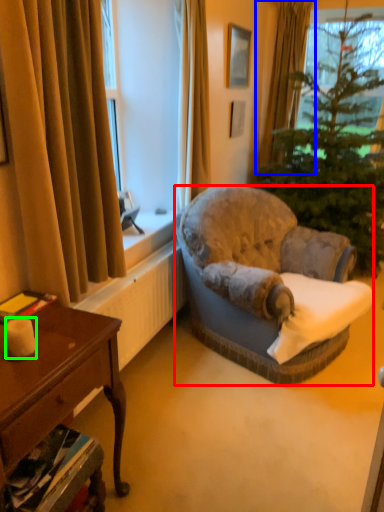
Question: Which object is positioned closest to chair (highlighted by a red box)? Select from curtain (highlighted by a blue box) and candle (highlighted by a green box).

Choices:
 (A) curtain
 (B) candle

Answer: (B)